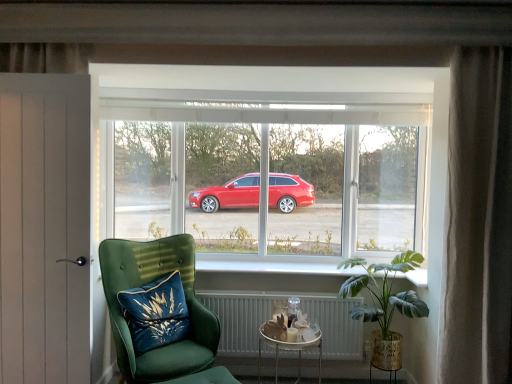
Question: Is transparent glass window at center turned away from blue velvet cushion at lower left?

Choices:
 (A) no
 (B) yes

Answer: (A)

Question: Does transparent glass window at center come in front of blue velvet cushion at lower left?

Choices:
 (A) no
 (B) yes

Answer: (A)

Question: From a real-world perspective, is transparent glass window at center physically below blue velvet cushion at lower left?

Choices:
 (A) no
 (B) yes

Answer: (A)

Question: Is transparent glass window at center next to blue velvet cushion at lower left?

Choices:
 (A) no
 (B) yes

Answer: (A)

Question: Does transparent glass window at center have a smaller size compared to blue velvet cushion at lower left?

Choices:
 (A) no
 (B) yes

Answer: (A)

Question: Based on their positions, is transparent glass window at center located to the left or right of velvet green armchair at lower left?

Choices:
 (A) right
 (B) left

Answer: (A)

Question: In terms of width, does transparent glass window at center look wider or thinner when compared to velvet green armchair at lower left?

Choices:
 (A) wide
 (B) thin

Answer: (B)

Question: Looking at the image, does transparent glass window at center seem bigger or smaller compared to velvet green armchair at lower left?

Choices:
 (A) small
 (B) big

Answer: (B)

Question: Choose the correct answer: Is transparent glass window at center inside velvet green armchair at lower left or outside it?

Choices:
 (A) inside
 (B) outside

Answer: (B)

Question: From the image's perspective, is metallic silver tray at lower center located above or below blue velvet cushion at lower left?

Choices:
 (A) above
 (B) below

Answer: (B)

Question: Is metallic silver tray at lower center situated inside blue velvet cushion at lower left or outside?

Choices:
 (A) outside
 (B) inside

Answer: (A)

Question: Considering the positions of metallic silver tray at lower center and blue velvet cushion at lower left in the image, is metallic silver tray at lower center wider or thinner than blue velvet cushion at lower left?

Choices:
 (A) thin
 (B) wide

Answer: (B)

Question: Is metallic silver tray at lower center taller or shorter than blue velvet cushion at lower left?

Choices:
 (A) short
 (B) tall

Answer: (B)

Question: Considering the positions of point (259, 269) and point (270, 198), is point (259, 269) closer or farther from the camera than point (270, 198)?

Choices:
 (A) closer
 (B) farther

Answer: (A)

Question: Considering the positions of white glossy window sill at center and transparent glass window at center in the image, is white glossy window sill at center taller or shorter than transparent glass window at center?

Choices:
 (A) tall
 (B) short

Answer: (B)